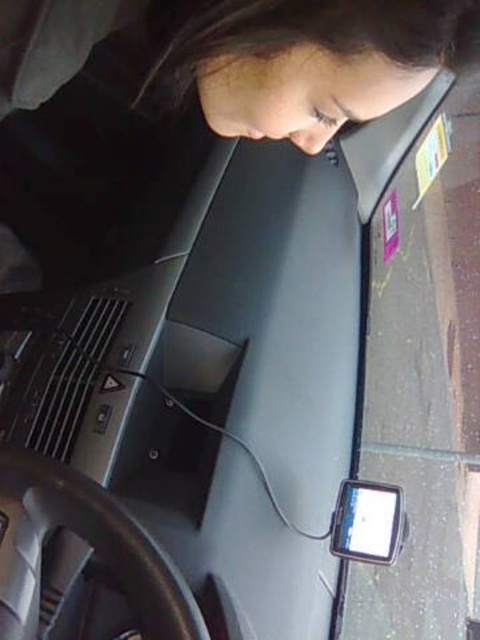
You are a passenger in a car and need to check both the matte black laptop at center and the matte black smartphone at lower right for directions. Which device should you look at if you want to see a larger display?

The matte black laptop at center has a larger display than the matte black smartphone at lower right, so you should look at the matte black laptop at center for a larger display.

You are a passenger in a car and want to check both the matte black laptop at center and the matte black smartphone at lower right. Which device is positioned higher relative to the other?

The matte black laptop at center is above the matte black smartphone at lower right, so the laptop is positioned higher.

You are a delivery driver who needs to place a package in the vehicle. The package must be placed between the matte black laptop at center and the matte black smartphone at lower right. The package measures 12 inches in length. Will the package fit between them?

The matte black laptop at center is 26.42 inches away from the matte black smartphone at lower right. Since the package is 12 inches long, it will fit between them as there is sufficient space.